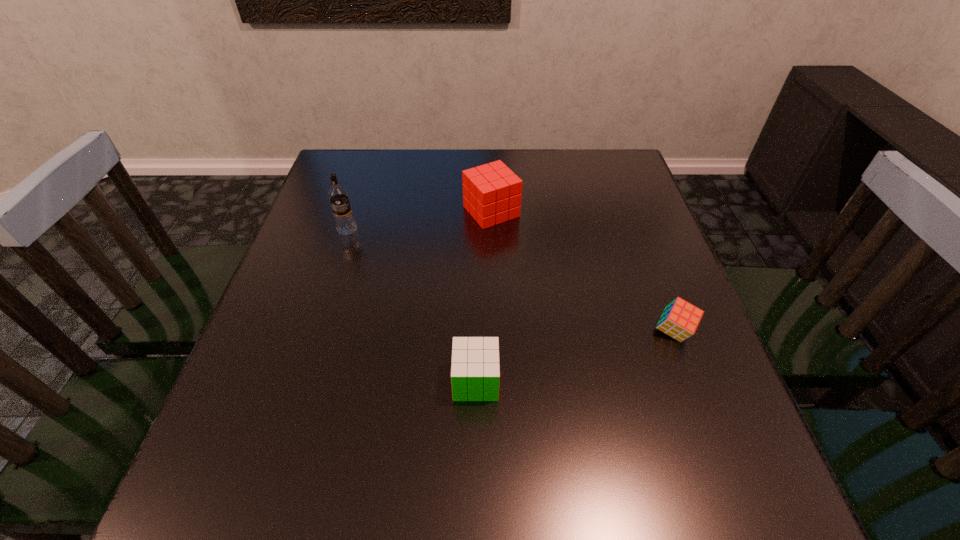
Point out which object is positioned as the nearest to the leftmost object. Please provide its 2D coordinates. Your answer should be formatted as a tuple, i.e. [(x, y)], where the tuple contains the x and y coordinates of a point satisfying the conditions above.

[(492, 195)]

Locate an element on the screen. This screenshot has height=540, width=960. the closest object to the tallest cube is located at coordinates (345, 224).

The image size is (960, 540). Find the location of `cube that stands as the closest to the third farthest object`. cube that stands as the closest to the third farthest object is located at coordinates (475, 370).

The width and height of the screenshot is (960, 540). Find the location of `cube that is the second nearest to the farthest cube`. cube that is the second nearest to the farthest cube is located at coordinates (475, 370).

Where is `free space that satisfies the following two spatial constraints: 1. on the back side of the nearest object; 2. on the left side of the rightmost object`? The height and width of the screenshot is (540, 960). free space that satisfies the following two spatial constraints: 1. on the back side of the nearest object; 2. on the left side of the rightmost object is located at coordinates (476, 332).

Identify the location of free space that satisfies the following two spatial constraints: 1. on the label of the leftmost object; 2. on the left side of the nearest object. (298, 381).

Locate an element on the screen. The width and height of the screenshot is (960, 540). free location that satisfies the following two spatial constraints: 1. on the back side of the farthest cube; 2. on the right side of the nearest object is located at coordinates (477, 212).

Locate an element on the screen. vacant space that satisfies the following two spatial constraints: 1. on the label of the leftmost object; 2. on the left side of the nearest object is located at coordinates (x=298, y=381).

Locate an element on the screen. free space that satisfies the following two spatial constraints: 1. on the back side of the nearest cube; 2. on the right side of the farthest cube is located at coordinates (477, 212).

Where is `free space in the image that satisfies the following two spatial constraints: 1. on the back side of the nearest object; 2. on the right side of the farthest cube`? free space in the image that satisfies the following two spatial constraints: 1. on the back side of the nearest object; 2. on the right side of the farthest cube is located at coordinates (477, 212).